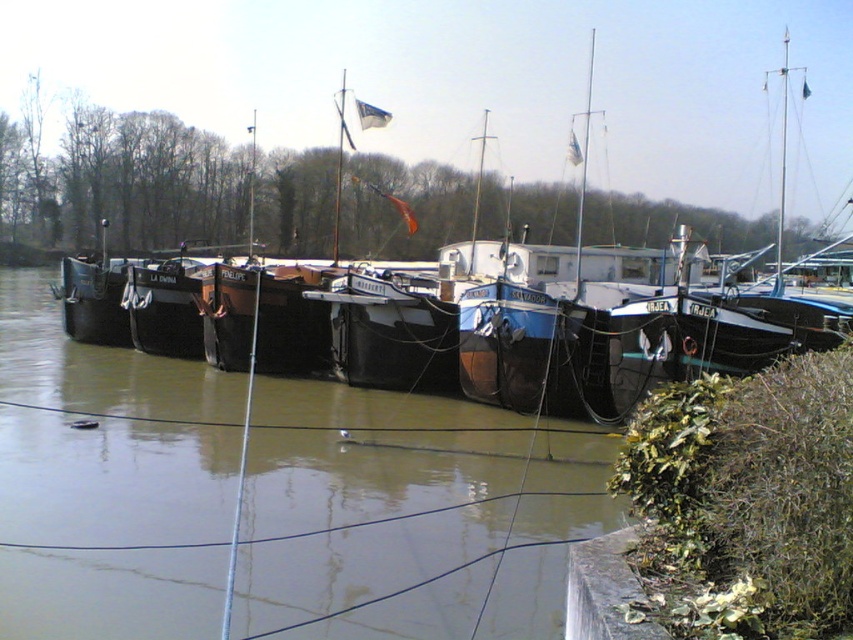
Question: Is brown matte water at center wider than blue wooden boat at center?

Choices:
 (A) no
 (B) yes

Answer: (A)

Question: Does brown matte water at center have a larger size compared to blue wooden boat at center?

Choices:
 (A) no
 (B) yes

Answer: (A)

Question: Can you confirm if brown matte water at center is thinner than blue wooden boat at center?

Choices:
 (A) yes
 (B) no

Answer: (A)

Question: Which object is closer to the camera taking this photo?

Choices:
 (A) brown matte water at center
 (B) blue wooden boat at center

Answer: (A)